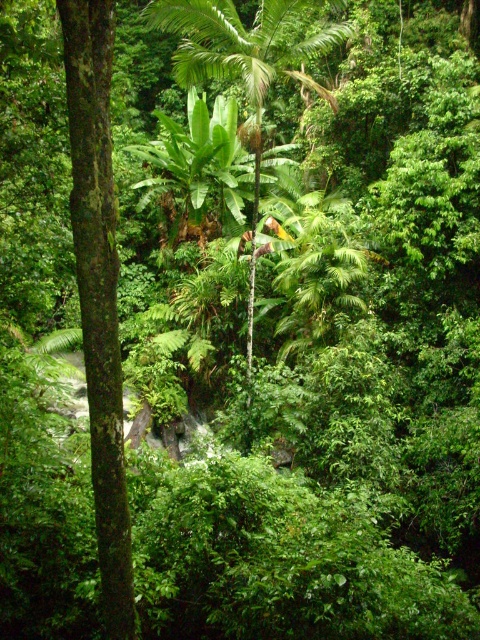
Is point (96, 179) positioned behind point (277, 3)?

No.

Between point (63, 56) and point (189, 8), which one is positioned behind?

Point (189, 8)

Which is behind, point (107, 67) or point (213, 44)?

Positioned behind is point (213, 44).

Locate an element on the screen. The width and height of the screenshot is (480, 640). green rough bark tree at left is located at coordinates (98, 291).